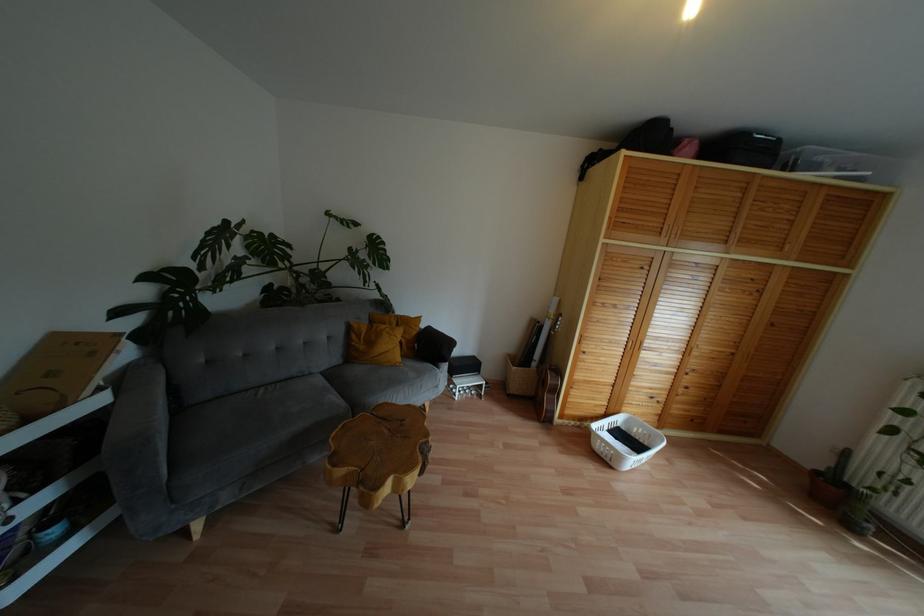
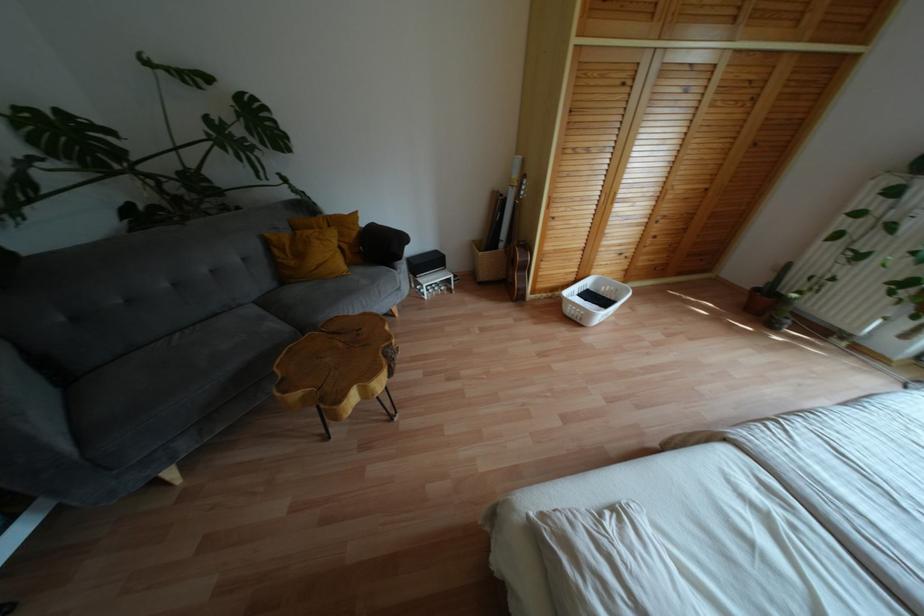
Where in the second image is the point corresponding to [397,359] from the first image?

(343, 267)